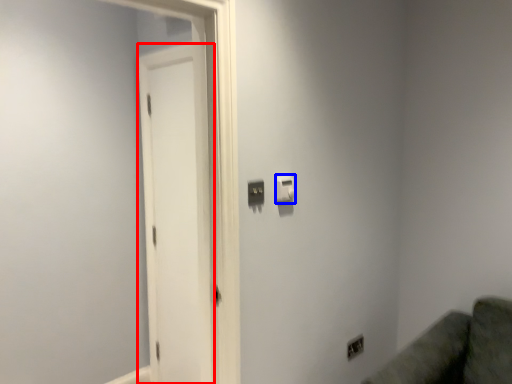
Question: Which object appears farthest to the camera in this image, screen door (highlighted by a red box) or light switch (highlighted by a blue box)?

Choices:
 (A) screen door
 (B) light switch

Answer: (A)